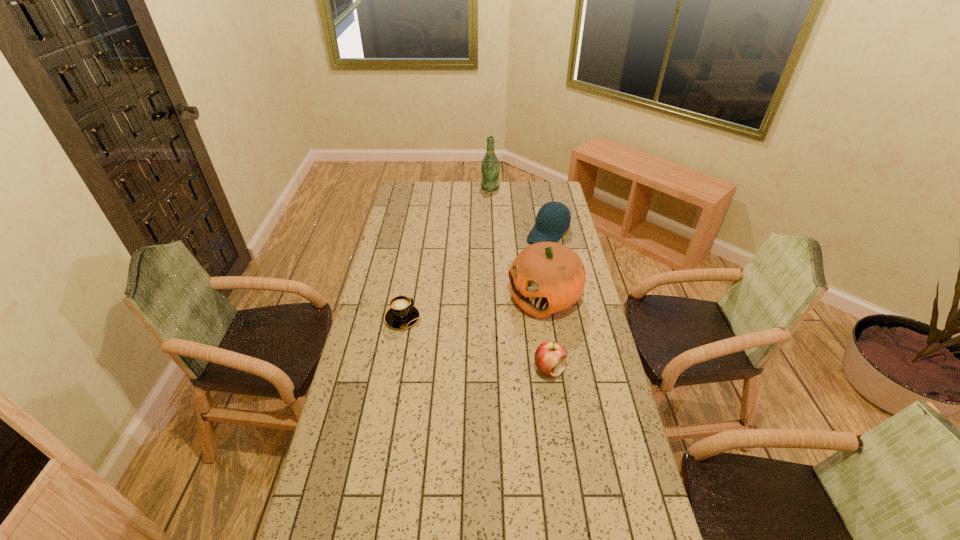
Where is `free space located 0.070m on the bitten side of the apple`? The image size is (960, 540). free space located 0.070m on the bitten side of the apple is located at coordinates (554, 400).

Find the location of a particular element. The width and height of the screenshot is (960, 540). vacant space located 0.270m on the face of the fourth shortest object is located at coordinates (462, 346).

What are the coordinates of `vacant region located 0.120m on the face of the fourth shortest object` in the screenshot? It's located at (492, 327).

Locate an element on the screen. The width and height of the screenshot is (960, 540). vacant area situated on the face of the fourth shortest object is located at coordinates (444, 356).

In order to click on vacant position located on the surface of the tallest object in this screenshot , I will do `click(487, 201)`.

This screenshot has width=960, height=540. I want to click on vacant area located 0.270m on the surface of the tallest object, so click(x=482, y=219).

Where is `free space located 0.190m on the surface of the tallest object`? The height and width of the screenshot is (540, 960). free space located 0.190m on the surface of the tallest object is located at coordinates (484, 210).

At what (x,y) coordinates should I click in order to perform the action: click on free space located on the front-facing side of the baseball cap. Please return your answer as a coordinate pair (x, y). Image resolution: width=960 pixels, height=540 pixels. Looking at the image, I should click on (507, 279).

Image resolution: width=960 pixels, height=540 pixels. I want to click on free space located on the front-facing side of the baseball cap, so click(x=516, y=271).

Identify the location of free space located 0.290m on the front-facing side of the baseball cap. Image resolution: width=960 pixels, height=540 pixels. (506, 280).